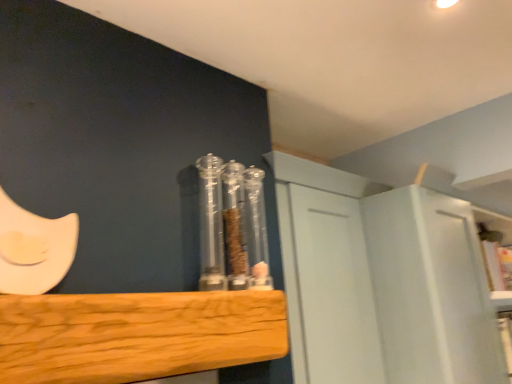
Question: Does point (249, 253) appear closer or farther from the camera than point (73, 327)?

Choices:
 (A) closer
 (B) farther

Answer: (B)

Question: From their relative heights in the image, would you say transparent plastic containers at center is taller or shorter than natural wood plank at center?

Choices:
 (A) tall
 (B) short

Answer: (A)

Question: Which of these objects is positioned farthest from the white matte cabinet at upper right?

Choices:
 (A) transparent plastic containers at center
 (B) natural wood plank at center

Answer: (B)

Question: Which object is positioned closest to the transparent plastic containers at center?

Choices:
 (A) natural wood plank at center
 (B) white matte cabinet at upper right

Answer: (A)